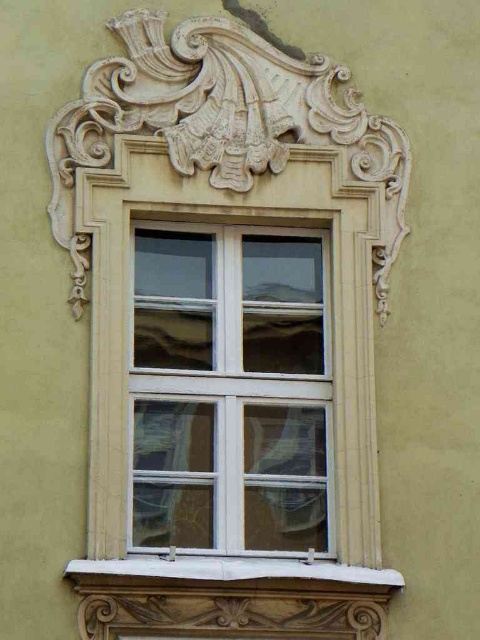
You are an architect inspecting the building facade. You need to determine if the clear glass window at center can be replaced with a larger one without altering the white stone window sill at lower center. Based on their current sizes, is this possible?

The clear glass window at center has a greater height compared to the white stone window sill at lower center. Since the window is already taller than the sill, replacing it with a larger one might require adjusting the sill, which is not allowed. Therefore, it is not possible to replace the window without altering the white stone window sill at lower center.

You are an architect designing a new building and want to replicate the window and sill from the image. The window must be wider than the sill. Can you confirm if the clear glass window at center is wider than the white stone window sill at lower center?

The clear glass window at center is less in width than the white stone window sill at lower center, so it cannot be replicated as wider than the sill.

You are an architect examining the building facade. You notice the clear glass window at center and the white stone window sill at lower center. Which object is closer to you from your viewpoint?

The clear glass window at center is closer to you than the white stone window sill at lower center because the white stone window sill at lower center is positioned behind it.